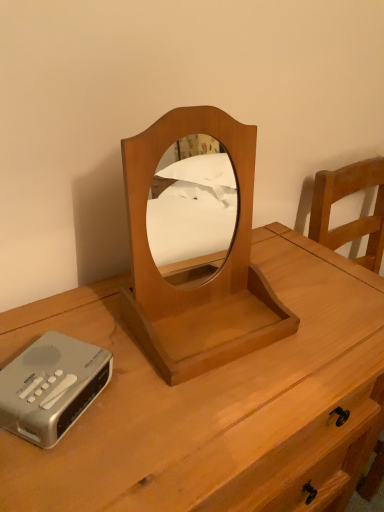
In order to click on vacant location below wooden mirror at center (from a real-world perspective) in this screenshot , I will do `click(210, 320)`.